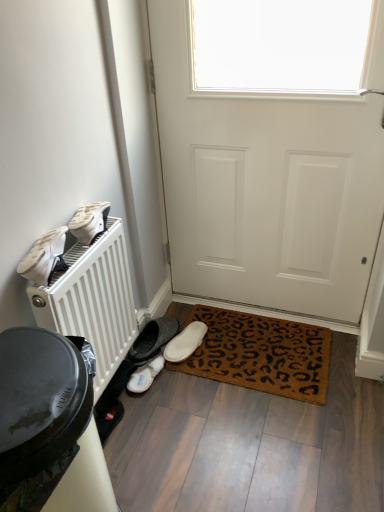
Question: From the image's perspective, is white suede shoes at left, which is the first footwear from front to back, located above or below white fluffy slippers at lower center, acting as the fourth footwear starting from the top?

Choices:
 (A) above
 (B) below

Answer: (A)

Question: From a real-world perspective, is white suede shoes at left, which is the first footwear from front to back, above or below white fluffy slippers at lower center, acting as the fourth footwear starting from the top?

Choices:
 (A) below
 (B) above

Answer: (B)

Question: Which object is positioned farthest from the brown coir mat at lower center?

Choices:
 (A) white fluffy slippers at lower center, which appears as the second footwear when viewed from the back
 (B) white suede shoes at left, which is the 4th footwear from back to front
 (C) white matte shoe at left, which appears as the second footwear when viewed from the front
 (D) white matte door at center
 (E) white suede slipper at lower center, placed as the 4th footwear when sorted from front to back

Answer: (B)

Question: Estimate the real-world distances between objects in this image. Which object is closer to the white matte door at center?

Choices:
 (A) white fluffy slippers at lower center, which appears as the second footwear when viewed from the back
 (B) black plastic trash can at lower left
 (C) white matte shoe at left, the 1th footwear from the top
 (D) white suede slipper at lower center, placed as the 4th footwear when sorted from front to back
 (E) brown coir mat at lower center

Answer: (E)